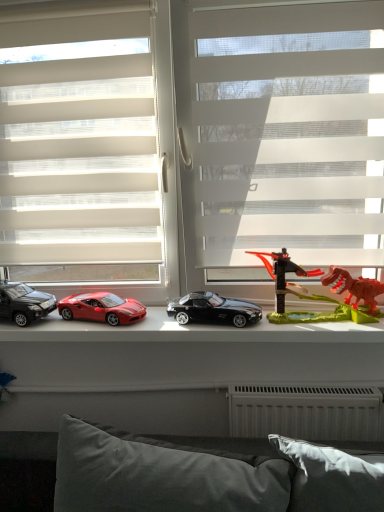
Measure the distance between shiny plastic toy cars at center and camera.

shiny plastic toy cars at center is 1.35 meters away from camera.

Measure the distance between gray fabric pillow at lower center and camera.

The depth of gray fabric pillow at lower center is 1.02 meters.

The height and width of the screenshot is (512, 384). In order to click on gray fabric pillow at lower center in this screenshot , I will do coord(163,474).

Measure the distance between point (x=305, y=291) and camera.

Point (x=305, y=291) is 5.01 feet away from camera.

Where is `transparent plastic dinosaur at right`? transparent plastic dinosaur at right is located at coordinates (289, 132).

The height and width of the screenshot is (512, 384). Identify the location of white sheer blinds at center, which appears as the 1th window when viewed from the left. (89, 152).

From the image's perspective, is white translucent blinds at center, the first window positioned from the right, located above or below shiny red car at center, which ranks as the 2th car in right-to-left order?

From the image's perspective, white translucent blinds at center, the first window positioned from the right, appears above shiny red car at center, which ranks as the 2th car in right-to-left order.

Does white translucent blinds at center, the second window positioned from the left, have a greater width compared to shiny red car at center, the second car viewed from the left?

Yes.

Is white translucent blinds at center, the second window positioned from the left, facing towards shiny red car at center, which ranks as the 2th car in right-to-left order?

Yes.

Considering the relative positions of white translucent blinds at center, the second window positioned from the left, and shiny red car at center, which ranks as the 2th car in right-to-left order, in the image provided, is white translucent blinds at center, the second window positioned from the left, to the left of shiny red car at center, which ranks as the 2th car in right-to-left order, from the viewer's perspective?

Incorrect, white translucent blinds at center, the second window positioned from the left, is not on the left side of shiny red car at center, which ranks as the 2th car in right-to-left order.

Is transparent plastic dinosaur at right inside shiny red car at center, which ranks as the 2th car in right-to-left order?

No, transparent plastic dinosaur at right is not inside shiny red car at center, which ranks as the 2th car in right-to-left order.

Can you confirm if shiny red car at center, which ranks as the 2th car in right-to-left order, is wider than transparent plastic dinosaur at right?

In fact, shiny red car at center, which ranks as the 2th car in right-to-left order, might be narrower than transparent plastic dinosaur at right.

From the image's perspective, which car is the 2nd one below the transparent plastic dinosaur at right? Please provide its 2D coordinates.

[(101, 308)]

From the image's perspective, which one is positioned higher, shiny red car at center, the second car viewed from the left, or transparent plastic dinosaur at right?

From the image's view, transparent plastic dinosaur at right is above.

Does gray fabric pillow at lower center have a greater height compared to transparent plastic dinosaur at right?

In fact, gray fabric pillow at lower center may be shorter than transparent plastic dinosaur at right.

From the image's perspective, is gray fabric pillow at lower center on transparent plastic dinosaur at right?

Incorrect, from the image's perspective, gray fabric pillow at lower center is lower than transparent plastic dinosaur at right.

Is gray fabric pillow at lower center at the right side of transparent plastic dinosaur at right?

In fact, gray fabric pillow at lower center is to the left of transparent plastic dinosaur at right.

From a real-world perspective, is gray fabric pillow at lower center on top of transparent plastic dinosaur at right?

No, from a real-world perspective, gray fabric pillow at lower center is not over transparent plastic dinosaur at right

Is translucent plastic dinosaur at right positioned in front of black metallic car at center, the first car from the right?

Yes.

Looking at this image, is translucent plastic dinosaur at right positioned beyond the bounds of black metallic car at center, the first car from the right?

Yes, translucent plastic dinosaur at right is located beyond the bounds of black metallic car at center, the first car from the right.

I want to click on car that is the 3rd one below the translucent plastic dinosaur at right (from a real-world perspective), so click(213, 309).

Can you confirm if gray fabric pillow at lower center is smaller than black metallic car at center, the 3th car from the left?

No.

Does gray fabric pillow at lower center turn towards black metallic car at center, the 3th car from the left?

No.

Considering the points (119, 492) and (196, 312), which point is in front, point (119, 492) or point (196, 312)?

The point (119, 492) is closer.

Considering the relative positions of gray fabric pillow at lower center and black metallic car at center, the 3th car from the left, in the image provided, is gray fabric pillow at lower center to the left of black metallic car at center, the 3th car from the left, from the viewer's perspective?

→ Yes, gray fabric pillow at lower center is to the left of black metallic car at center, the 3th car from the left.

Is black metallic car at center, the first car from the right, turned away from gray fabric pillow at lower center?

No, gray fabric pillow at lower center is not at the back of black metallic car at center, the first car from the right.

From a real-world perspective, is black metallic car at center, the 3th car from the left, physically located above or below gray fabric pillow at lower center?

Clearly, from a real-world perspective, black metallic car at center, the 3th car from the left, is above gray fabric pillow at lower center.

Relative to gray fabric pillow at lower center, is black metallic car at center, the 3th car from the left, in front or behind?

black metallic car at center, the 3th car from the left, is behind gray fabric pillow at lower center.

At what (x,y) coordinates should I click in order to perform the action: click on car that is the 1st one when counting backward from the gray fabric pillow at lower center. Please return your answer as a coordinate pair (x, y). The height and width of the screenshot is (512, 384). Looking at the image, I should click on (213, 309).

What are the coordinates of `the 2nd car behind the translucent plastic dinosaur at right` in the screenshot? It's located at (101, 308).

Measure the distance from translucent plastic dinosaur at right to shiny red car at center, which ranks as the 2th car in right-to-left order.

The distance of translucent plastic dinosaur at right from shiny red car at center, which ranks as the 2th car in right-to-left order, is 22.10 inches.

Which of these two, translucent plastic dinosaur at right or shiny red car at center, which ranks as the 2th car in right-to-left order, stands taller?

Standing taller between the two is translucent plastic dinosaur at right.

Is translucent plastic dinosaur at right facing towards shiny red car at center, the second car viewed from the left?

No.

You are a GUI agent. You are given a task and a screenshot of the screen. Output one action in this format:
    pyautogui.click(x=<x>, y=<y>)
    Task: Click on the 2nd car behind when counting from the white translucent blinds at center, the first window positioned from the right
    This screenshot has height=512, width=384.
    Given the screenshot: What is the action you would take?
    pyautogui.click(x=101, y=308)

Find the location of a particular element. This screenshot has height=512, width=384. bay window above the shiny red car at center, the second car viewed from the left (from the image's perspective) is located at coordinates (289, 132).

Based on their spatial positions, is transparent plastic dinosaur at right or shiny plastic toy cars at center further from shiny black car at left, placed as the 1th car when sorted from left to right?

transparent plastic dinosaur at right is further to shiny black car at left, placed as the 1th car when sorted from left to right.

When comparing their distances from black metallic car at center, the 3th car from the left, does shiny plastic toy cars at center or gray fabric pillow at lower center seem further?

gray fabric pillow at lower center lies further to black metallic car at center, the 3th car from the left, than the other object.

When comparing their distances from white sheer blinds at center, which is the second window from right to left, does translucent plastic dinosaur at right or gray fabric pillow at lower center seem closer?

translucent plastic dinosaur at right.

From the image, which object appears to be nearer to shiny plastic toy cars at center, shiny red car at center, which ranks as the 2th car in right-to-left order, or black metallic car at center, the first car from the right?

Based on the image, black metallic car at center, the first car from the right, appears to be nearer to shiny plastic toy cars at center.

When comparing their distances from black metallic car at center, the first car from the right, does shiny plastic toy cars at center or transparent plastic dinosaur at right seem further?

transparent plastic dinosaur at right is further to black metallic car at center, the first car from the right.

Looking at the image, which one is located closer to gray fabric pillow at lower center, shiny black car at left, placed as the 1th car when sorted from left to right, or shiny red car at center, which ranks as the 2th car in right-to-left order?

shiny red car at center, which ranks as the 2th car in right-to-left order, is closer to gray fabric pillow at lower center.

From the image, which object appears to be nearer to white translucent blinds at center, the first window positioned from the right, shiny black car at left, placed as the 3th car when sorted from right to left, or shiny red car at center, the second car viewed from the left?

Among the two, shiny red car at center, the second car viewed from the left, is located nearer to white translucent blinds at center, the first window positioned from the right.

Looking at the image, which one is located closer to white translucent blinds at center, the first window positioned from the right, black metallic car at center, the 3th car from the left, or white sheer blinds at center, which appears as the 1th window when viewed from the left?

white sheer blinds at center, which appears as the 1th window when viewed from the left, is closer to white translucent blinds at center, the first window positioned from the right.

I want to click on window sill situated between white sheer blinds at center, which is the second window from right to left, and transparent plastic dinosaur at right from left to right, so click(190, 331).

You are a GUI agent. You are given a task and a screenshot of the screen. Output one action in this format:
    pyautogui.click(x=<x>, y=<y>)
    Task: Click on the car positioned between gray fabric pillow at lower center and shiny red car at center, the second car viewed from the left, from near to far
    
    Given the screenshot: What is the action you would take?
    213,309

The height and width of the screenshot is (512, 384). Identify the location of pillow between shiny black car at left, placed as the 1th car when sorted from left to right, and translucent plastic dinosaur at right from left to right. (163, 474).

The image size is (384, 512). I want to click on window between white sheer blinds at center, which is the second window from right to left, and shiny red car at center, which ranks as the 2th car in right-to-left order, in the vertical direction, so click(281, 135).